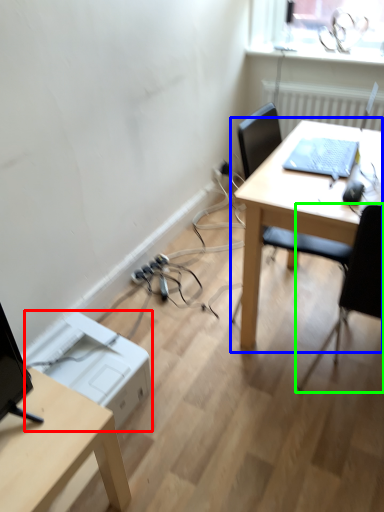
Question: Which object is the closest to the printer (highlighted by a red box)? Choose among these: table (highlighted by a blue box) or chair (highlighted by a green box).

Choices:
 (A) table
 (B) chair

Answer: (A)